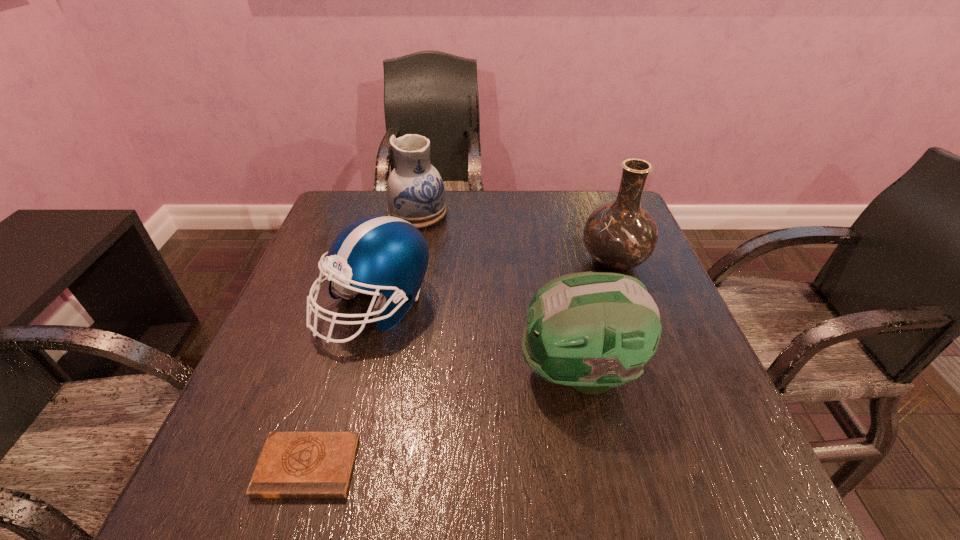
The width and height of the screenshot is (960, 540). I want to click on free spot located 0.230m on the visor of the right football helmet, so click(396, 372).

Find the location of a particular element. free space located 0.270m at the front of the left football helmet with the faceguard is located at coordinates (327, 495).

This screenshot has width=960, height=540. I want to click on object positioned at the far edge, so click(x=415, y=192).

This screenshot has height=540, width=960. I want to click on object that is positioned at the near edge, so click(x=292, y=464).

In order to click on football helmet located in the left edge section of the desktop in this screenshot , I will do `click(388, 255)`.

Identify the location of diary that is at the left edge. (292, 464).

I want to click on vase at the right edge, so click(621, 235).

Locate an element on the screen. football helmet present at the right edge is located at coordinates pyautogui.click(x=593, y=331).

The image size is (960, 540). I want to click on object at the near left corner, so click(292, 464).

The height and width of the screenshot is (540, 960). In order to click on vacant space at the far edge of the desktop in this screenshot , I will do `click(446, 227)`.